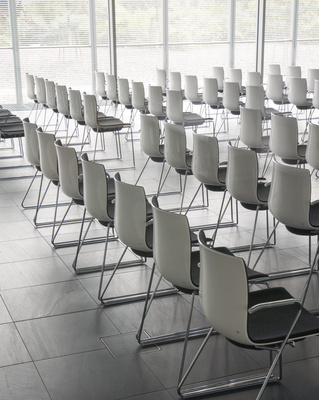
Where is `vertical pane`? The width and height of the screenshot is (319, 400). vertical pane is located at coordinates (15, 43), (91, 43), (163, 34), (232, 40), (297, 36).